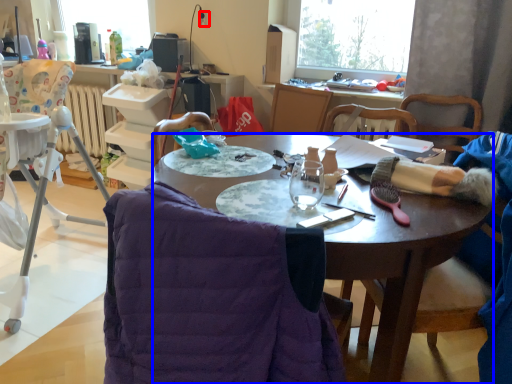
Question: Which point is closer to the camera, power outlet (highlighted by a red box) or desk (highlighted by a blue box)?

Choices:
 (A) power outlet
 (B) desk

Answer: (B)